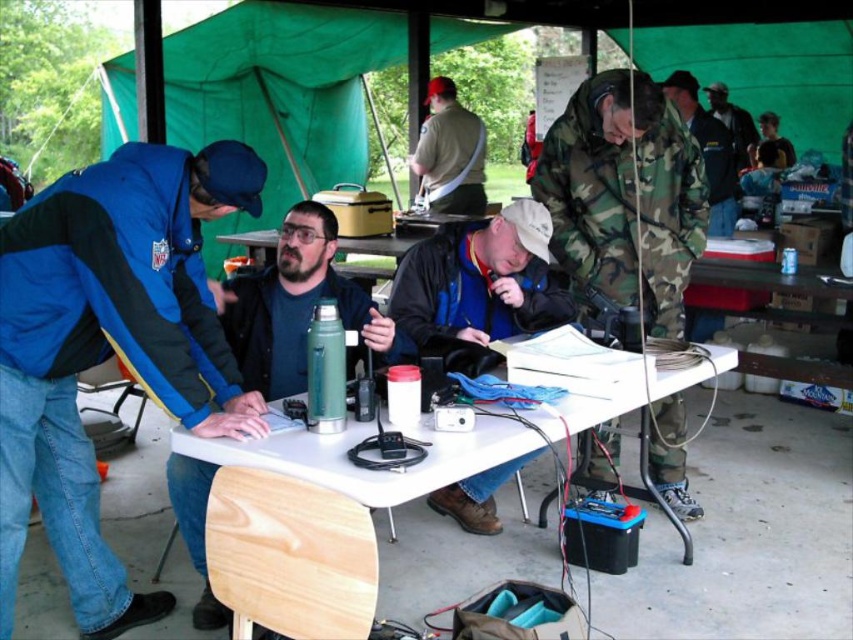
You are organizing a picnic and need to place the matte black jacket at center and the matte green thermos at center on a shelf. If the shelf has limited space, which item should you place first to ensure both fit?

The matte black jacket at center is smaller than the matte green thermos at center, so you should place the matte green thermos at center first to accommodate its larger size, then the smaller matte black jacket at center will fit alongside.

In the scene, there are two people wearing the blue fleece jacket at left and the camouflage uniform at right. Which one is located more to the left side of the image?

The blue fleece jacket at left is more to the left side of the image.

You are standing at the back of the image and want to hand a tool to the person wearing the blue fleece jacket at left and the camouflage uniform at right. Which person should you approach first if you want to give the tool to the one closer to you?

The blue fleece jacket at left is below camouflage uniform at right, so the camouflage uniform at right is closer to you. Approach the camouflage uniform at right first.